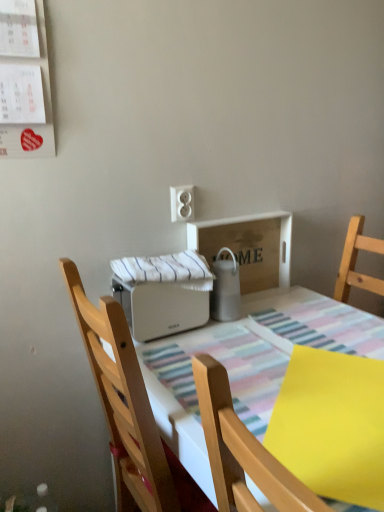
You are a GUI agent. You are given a task and a screenshot of the screen. Output one action in this format:
    pyautogui.click(x=<x>, y=<y>)
    Task: Click on the vacant space that's between satin silver thermos at center, which is the 2th appliance in left-to-right order, and yellow matte paper at lower right
    
    Given the screenshot: What is the action you would take?
    pyautogui.click(x=261, y=355)